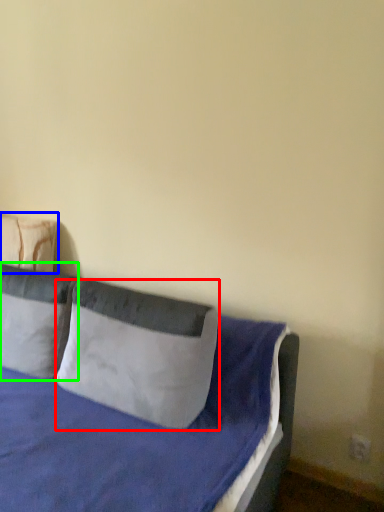
Question: Estimate the real-world distances between objects in this image. Which object is farther from pillow (highlighted by a red box), pillow (highlighted by a blue box) or pillow (highlighted by a green box)?

Choices:
 (A) pillow
 (B) pillow

Answer: (A)